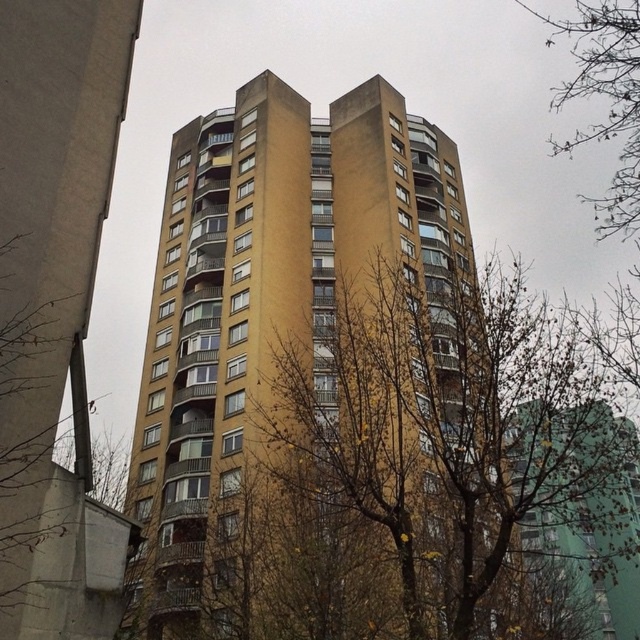
You are a city planner analyzing the image of the residential building. You need to determine which of the two bare branches, the bare branches at center or the bare branches at upper right, is closer to the building. Based on their sizes in the image, which one is more likely closer?

The bare branches at center is smaller than the bare branches at upper right, so it is more likely further away from the building. Therefore, the bare branches at upper right is closer to the building.

You are a city planner assessing the spacing between two sets of bare branches in the foreground of the residential building scene. Given that the distance between the bare branches at center and the bare branches at upper right is critical for ensuring adequate sunlight penetration to the building facade, can the current spacing allow sufficient light to reach the building walls?

The bare branches at center and bare branches at upper right are 47.20 feet apart. This distance likely allows sufficient sunlight to reach the building walls as the branches are spaced far enough apart not to cast overlapping shadows on the facade.